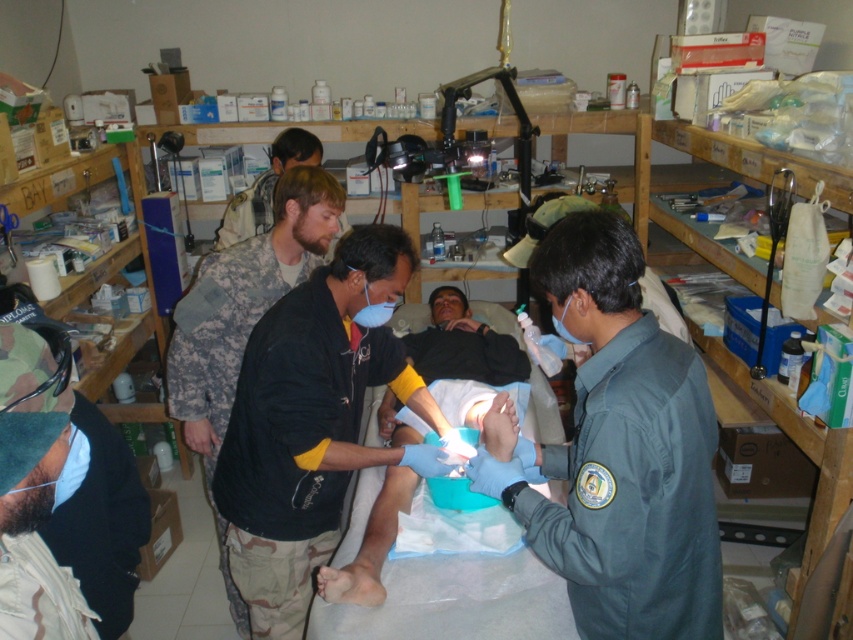
Question: Does black matte shirt at center have a smaller size compared to camouflage uniform at center?

Choices:
 (A) yes
 (B) no

Answer: (A)

Question: Among these objects, which one is nearest to the camera?

Choices:
 (A) camouflage uniform at center
 (B) green uniform at center

Answer: (B)

Question: Does green uniform at center come in front of camouflage uniform at center?

Choices:
 (A) no
 (B) yes

Answer: (B)

Question: Is green uniform at center smaller than black matte shirt at center?

Choices:
 (A) no
 (B) yes

Answer: (B)

Question: Among these objects, which one is nearest to the camera?

Choices:
 (A) green uniform at center
 (B) camouflage uniform at center

Answer: (A)

Question: Among these objects, which one is farthest from the camera?

Choices:
 (A) black matte shirt at center
 (B) camouflage uniform at center

Answer: (B)